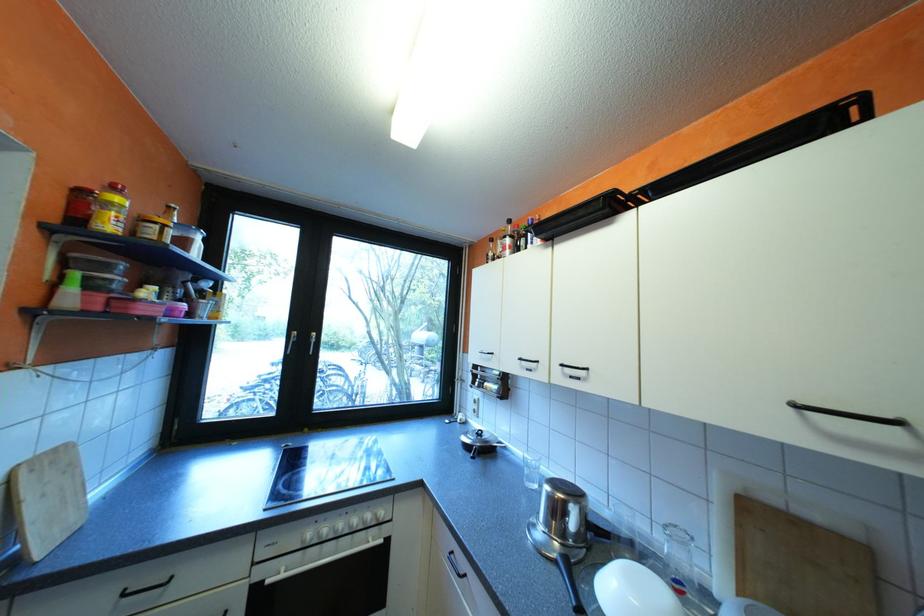
Describe the element at coordinates (290, 341) in the screenshot. The image size is (924, 616). I see `a white window handle` at that location.